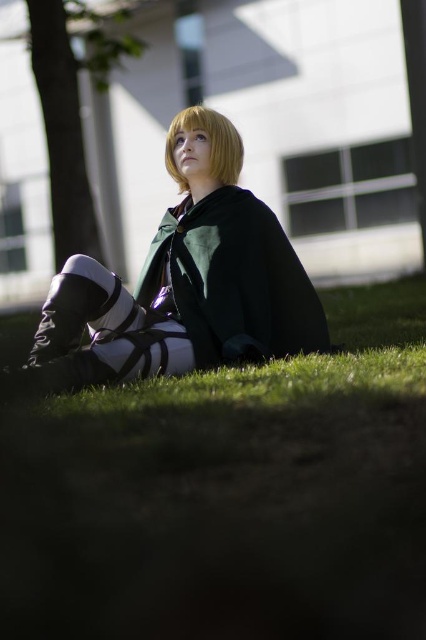
Question: Can you confirm if matte green cape at center is positioned to the left of green matte cape at center?

Choices:
 (A) yes
 (B) no

Answer: (A)

Question: Which of these objects is positioned closest to the green matte cape at center?

Choices:
 (A) matte green cape at center
 (B) green leafy tree at left

Answer: (A)

Question: Which of these objects is positioned farthest from the blonde hair at upper center?

Choices:
 (A) green leafy tree at left
 (B) green matte cape at center
 (C) matte green cape at center

Answer: (A)

Question: Is green leafy tree at left wider than blonde hair at upper center?

Choices:
 (A) no
 (B) yes

Answer: (B)

Question: Which of the following is the closest to the observer?

Choices:
 (A) green matte cape at center
 (B) matte green cape at center
 (C) green leafy tree at left
 (D) blonde hair at upper center

Answer: (B)

Question: Is green matte cape at center positioned behind blonde hair at upper center?

Choices:
 (A) no
 (B) yes

Answer: (A)